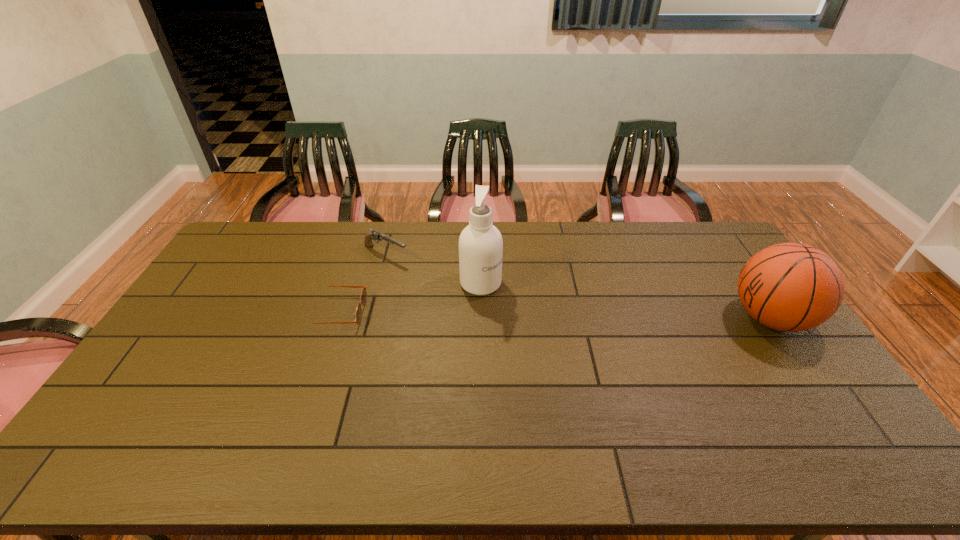
This screenshot has width=960, height=540. What are the coordinates of `free space on the desktop that is between the sunglasses and the rightmost object and is positioned on the front label of the tallest object` in the screenshot? It's located at (524, 315).

Locate an element on the screen. The height and width of the screenshot is (540, 960). free space on the desktop that is between the shortest object and the rightmost object and is positioned aiming along the barrel of the farthest object is located at coordinates (506, 314).